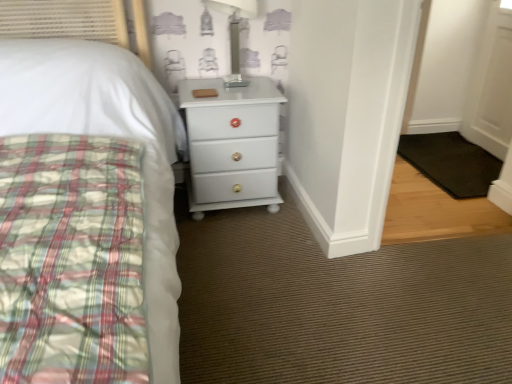
Question: Considering the relative sizes of black rubber mat at lower right and transparent glass table lamp at upper center in the image provided, is black rubber mat at lower right wider than transparent glass table lamp at upper center?

Choices:
 (A) no
 (B) yes

Answer: (B)

Question: From a real-world perspective, is black rubber mat at lower right on top of transparent glass table lamp at upper center?

Choices:
 (A) yes
 (B) no

Answer: (B)

Question: Considering the relative sizes of black rubber mat at lower right and transparent glass table lamp at upper center in the image provided, is black rubber mat at lower right smaller than transparent glass table lamp at upper center?

Choices:
 (A) no
 (B) yes

Answer: (A)

Question: Is black rubber mat at lower right beside transparent glass table lamp at upper center?

Choices:
 (A) yes
 (B) no

Answer: (B)

Question: From a real-world perspective, is black rubber mat at lower right under transparent glass table lamp at upper center?

Choices:
 (A) no
 (B) yes

Answer: (B)

Question: Considering the relative positions of black rubber mat at lower right and transparent glass table lamp at upper center in the image provided, is black rubber mat at lower right to the left of transparent glass table lamp at upper center from the viewer's perspective?

Choices:
 (A) yes
 (B) no

Answer: (B)

Question: Is the depth of transparent glass table lamp at upper center greater than that of white glossy chest of drawers at center?

Choices:
 (A) yes
 (B) no

Answer: (B)

Question: Can white glossy chest of drawers at center be found inside transparent glass table lamp at upper center?

Choices:
 (A) yes
 (B) no

Answer: (B)

Question: Is transparent glass table lamp at upper center looking in the opposite direction of white glossy chest of drawers at center?

Choices:
 (A) yes
 (B) no

Answer: (B)

Question: Is transparent glass table lamp at upper center to the left of white glossy chest of drawers at center from the viewer's perspective?

Choices:
 (A) no
 (B) yes

Answer: (A)

Question: Can you confirm if transparent glass table lamp at upper center is smaller than white glossy chest of drawers at center?

Choices:
 (A) no
 (B) yes

Answer: (B)

Question: Are transparent glass table lamp at upper center and white glossy chest of drawers at center making contact?

Choices:
 (A) no
 (B) yes

Answer: (A)

Question: From a real-world perspective, is white glossy chest of drawers at center positioned under black rubber mat at lower right based on gravity?

Choices:
 (A) yes
 (B) no

Answer: (B)